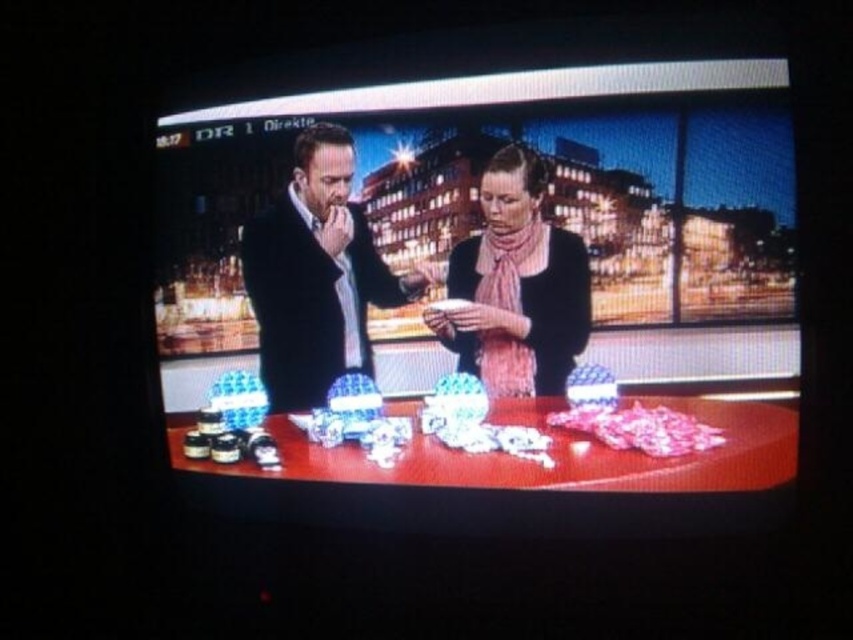
Question: Which point appears closest to the camera in this image?

Choices:
 (A) (560, 436)
 (B) (578, 289)
 (C) (308, 323)

Answer: (B)

Question: Is black woolen sweater at center bigger than pink striped scarf at center?

Choices:
 (A) yes
 (B) no

Answer: (A)

Question: Is shiny plastic table at center in front of pink striped scarf at center?

Choices:
 (A) no
 (B) yes

Answer: (B)

Question: Among these points, which one is farthest from the camera?

Choices:
 (A) (375, 300)
 (B) (734, 456)
 (C) (515, 257)

Answer: (A)

Question: Where is shiny plastic table at center located in relation to pink striped scarf at center in the image?

Choices:
 (A) right
 (B) left

Answer: (B)

Question: Which point appears closest to the camera in this image?

Choices:
 (A) (287, 298)
 (B) (479, 259)

Answer: (B)